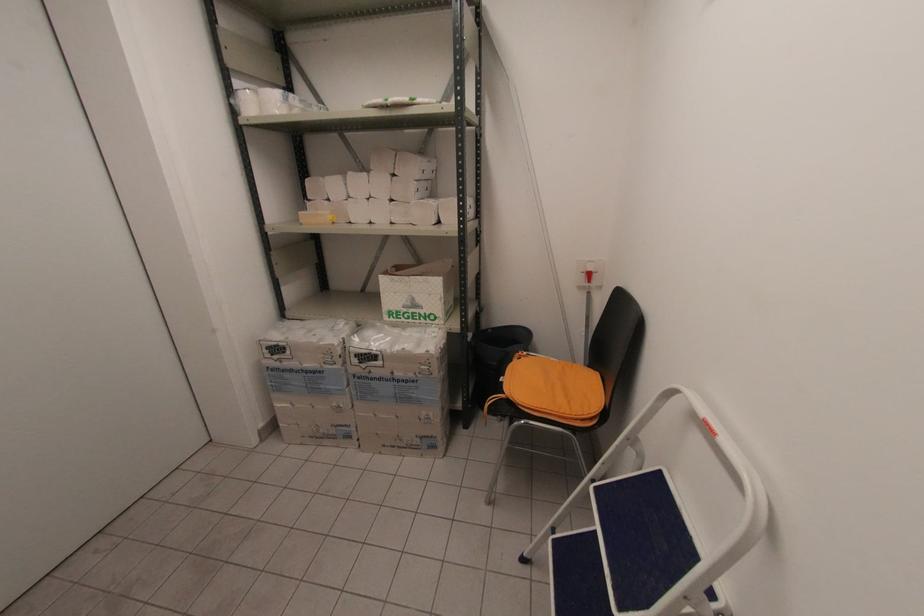
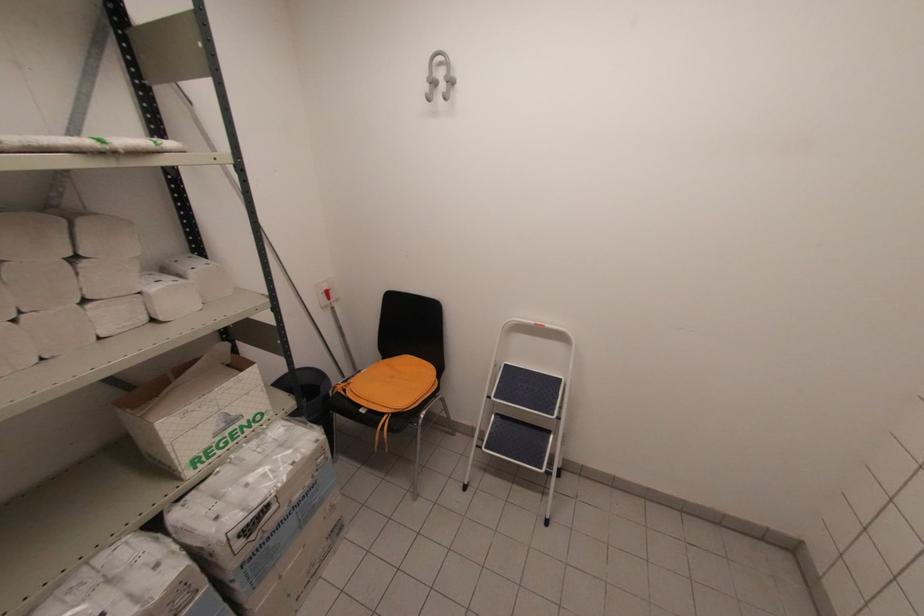
The point at (396, 174) is marked in the first image. Where is the corresponding point in the second image?

(81, 254)